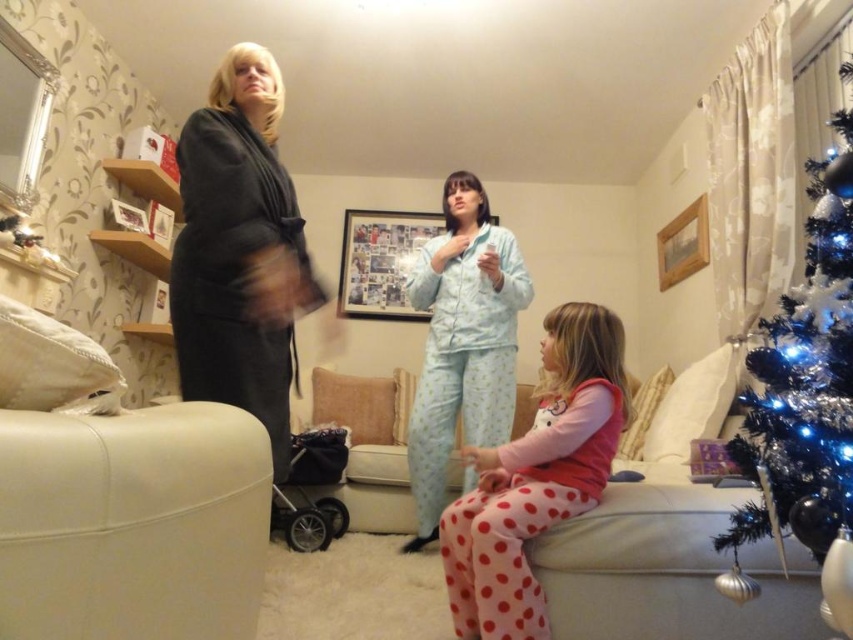
You are a parent holding a toddler who wants to reach the shiny metallic tree at right. The toddler is currently wearing the light blue cotton pajamas at center. If the toddler stretches their arms fully, they can reach 3 feet. Can they reach the tree?

The shiny metallic tree at right is 4.30 feet away from the light blue cotton pajamas at center. Since the toddler can only reach 3 feet, they cannot reach the tree.

You are a guest at this holiday gathering and need to choose between the dark gray robe at left and the pink polka dot pajamas at lower center for a cozy outfit. Which one reaches higher up when worn?

The dark gray robe at left is taller than the pink polka dot pajamas at lower center, so it reaches higher up when worn.

You are a guest at this holiday gathering and want to take a photo of the shiny metallic tree at right without any obstructions. However, the light blue cotton pajamas at center are blocking your view. Can you move the pajamas to the side to get a clear shot?

The shiny metallic tree at right is positioned over the light blue cotton pajamas at center, so moving the light blue cotton pajamas at center would allow you to see the tree clearly.